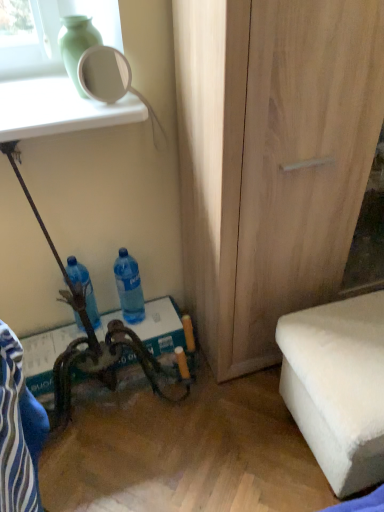
Question: From a real-world perspective, is blue translucent bottle at lower center, which is the 1th bottle from right to left, under white fluffy ottoman at lower right?

Choices:
 (A) yes
 (B) no

Answer: (B)

Question: Are blue translucent bottle at lower center, which is the 1th bottle from right to left, and white fluffy ottoman at lower right located far from each other?

Choices:
 (A) no
 (B) yes

Answer: (A)

Question: Is blue translucent bottle at lower center, placed as the 2th bottle when sorted from left to right, smaller than white fluffy ottoman at lower right?

Choices:
 (A) yes
 (B) no

Answer: (A)

Question: Considering the relative sizes of blue translucent bottle at lower center, which is the 1th bottle from right to left, and white fluffy ottoman at lower right in the image provided, is blue translucent bottle at lower center, which is the 1th bottle from right to left, taller than white fluffy ottoman at lower right?

Choices:
 (A) yes
 (B) no

Answer: (B)

Question: From the image's perspective, is blue translucent bottle at lower center, which is the 1th bottle from right to left, located above white fluffy ottoman at lower right?

Choices:
 (A) no
 (B) yes

Answer: (B)

Question: From a real-world perspective, is green matte vase at upper left above or below blue plastic bottle at lower left, which appears as the first bottle when viewed from the left?

Choices:
 (A) above
 (B) below

Answer: (A)

Question: From the image's perspective, is green matte vase at upper left located above or below blue plastic bottle at lower left, which appears as the first bottle when viewed from the left?

Choices:
 (A) above
 (B) below

Answer: (A)

Question: In the image, is green matte vase at upper left positioned in front of or behind blue plastic bottle at lower left, which appears as the first bottle when viewed from the left?

Choices:
 (A) front
 (B) behind

Answer: (A)

Question: In terms of height, does green matte vase at upper left look taller or shorter compared to blue plastic bottle at lower left, which appears as the first bottle when viewed from the left?

Choices:
 (A) tall
 (B) short

Answer: (B)

Question: In terms of size, does white glossy mirror at upper left appear bigger or smaller than blue fabric swivel chair at lower left?

Choices:
 (A) small
 (B) big

Answer: (A)

Question: Would you say white glossy mirror at upper left is inside or outside blue fabric swivel chair at lower left?

Choices:
 (A) inside
 (B) outside

Answer: (B)

Question: From the image's perspective, relative to blue fabric swivel chair at lower left, is white glossy mirror at upper left above or below?

Choices:
 (A) above
 (B) below

Answer: (A)

Question: From a real-world perspective, relative to blue fabric swivel chair at lower left, is white glossy mirror at upper left vertically above or below?

Choices:
 (A) above
 (B) below

Answer: (A)

Question: Based on their sizes in the image, would you say green matte vase at upper left is bigger or smaller than white fluffy ottoman at lower right?

Choices:
 (A) small
 (B) big

Answer: (A)

Question: Considering the positions of green matte vase at upper left and white fluffy ottoman at lower right in the image, is green matte vase at upper left taller or shorter than white fluffy ottoman at lower right?

Choices:
 (A) short
 (B) tall

Answer: (A)